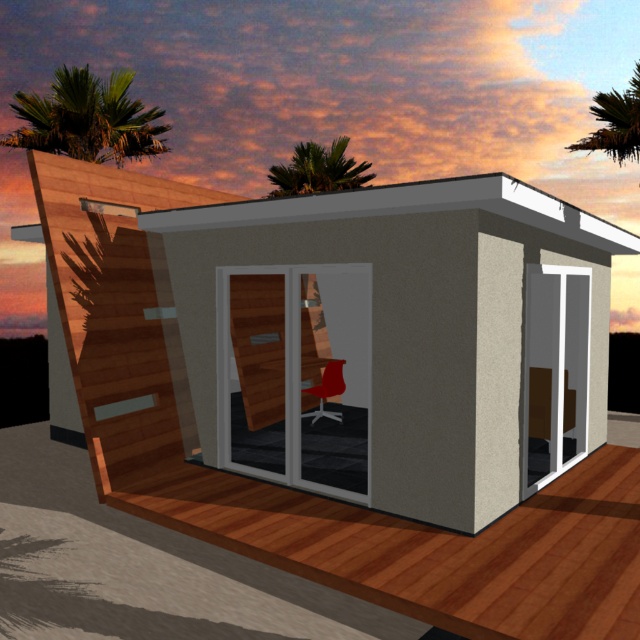
You are planning to install a solar panel system between the wooden hut at center and the green leafy palm tree at upper right. The solar panels require a minimum distance of 50 feet between the two structures for proper installation. Can the solar panels be installed in this location?

The wooden hut at center is 53.60 feet from the green leafy palm tree at upper right. Since the required minimum distance is 50 feet, the solar panels can be installed in this location.

You are planning to build a garden and want to place both the wooden hut at center and the green leafy palm tree at upper left in your backyard. Based on their sizes, which one should you place closer to the entrance to ensure they don

The wooden hut at center is smaller than the green leafy palm tree at upper left, so you should place the wooden hut at center closer to the entrance to ensure they are proportionally spaced.